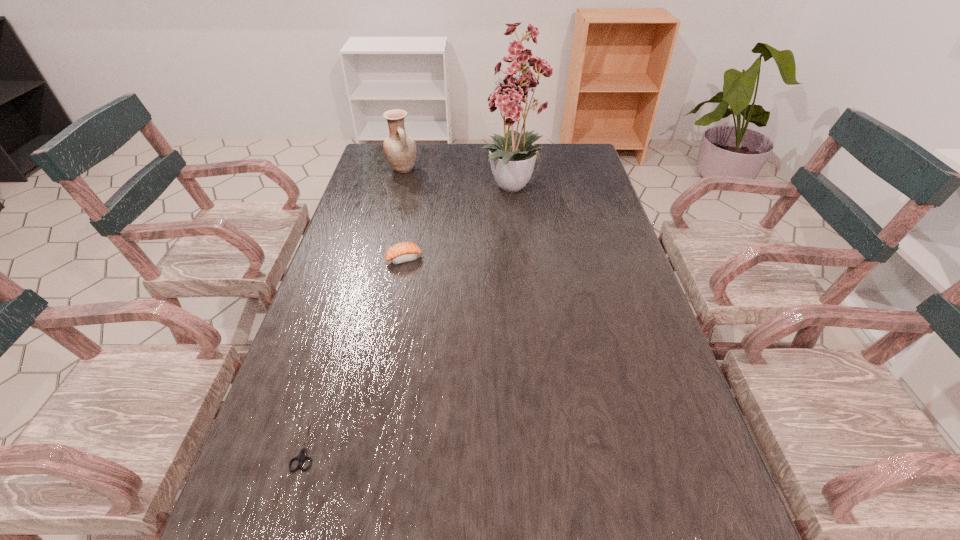
Identify the location of flower arrangement at the far edge. (511, 159).

You are a GUI agent. You are given a task and a screenshot of the screen. Output one action in this format:
    pyautogui.click(x=<x>, y=<y>)
    Task: Click on the pottery situated at the far edge
    
    Given the screenshot: What is the action you would take?
    pyautogui.click(x=400, y=149)

Locate an element on the screen. pottery that is positioned at the left edge is located at coordinates (400, 149).

Where is `sushi that is at the left edge`? The height and width of the screenshot is (540, 960). sushi that is at the left edge is located at coordinates (403, 252).

Where is `shears located at the left edge`? shears located at the left edge is located at coordinates (302, 456).

Find the location of a particular element. The height and width of the screenshot is (540, 960). object situated at the far left corner is located at coordinates coord(400,149).

This screenshot has height=540, width=960. Find the location of `vacant space at the far edge of the desktop`. vacant space at the far edge of the desktop is located at coordinates (464, 167).

The height and width of the screenshot is (540, 960). In order to click on vacant space at the left edge in this screenshot , I will do `click(332, 367)`.

The image size is (960, 540). In the image, there is a desktop. Identify the location of free space at the right edge. (615, 222).

Image resolution: width=960 pixels, height=540 pixels. In order to click on vacant space at the far right corner of the desktop in this screenshot , I will do `click(549, 148)`.